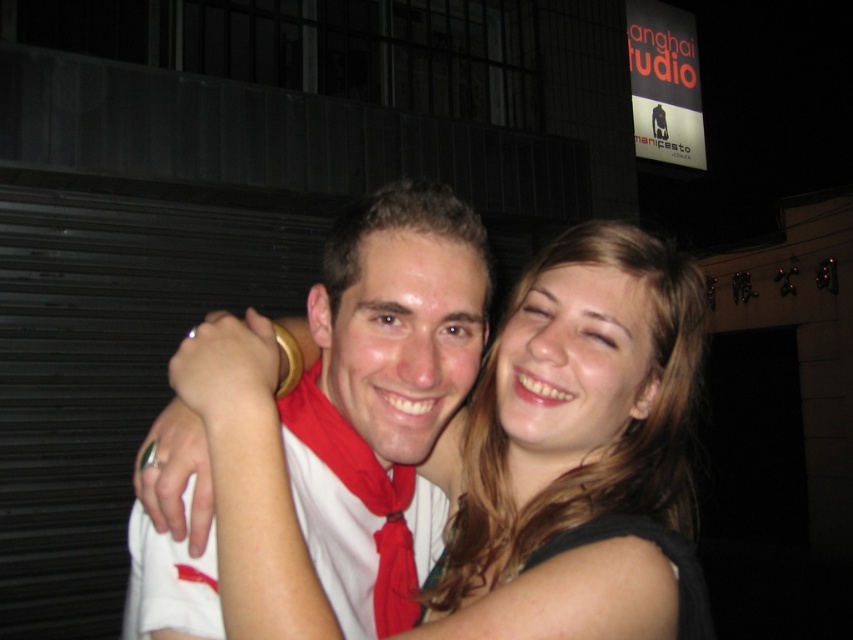
Based on the scene description, can you determine the spatial relationship between the blonde hair at center and the white matte shirt at center?

The blonde hair at center is below the white matte shirt at center, so the white matte shirt at center is positioned above the blonde hair at center.

You are a photographer at the Shanghai Studio event tonight. You need to ensure that the blonde hair at center and the white matte shirt at center are both visible in the frame. Based on their positions, which object is closer to the camera?

The blonde hair at center is shorter than the white matte shirt at center, so the blonde hair at center is closer to the camera.